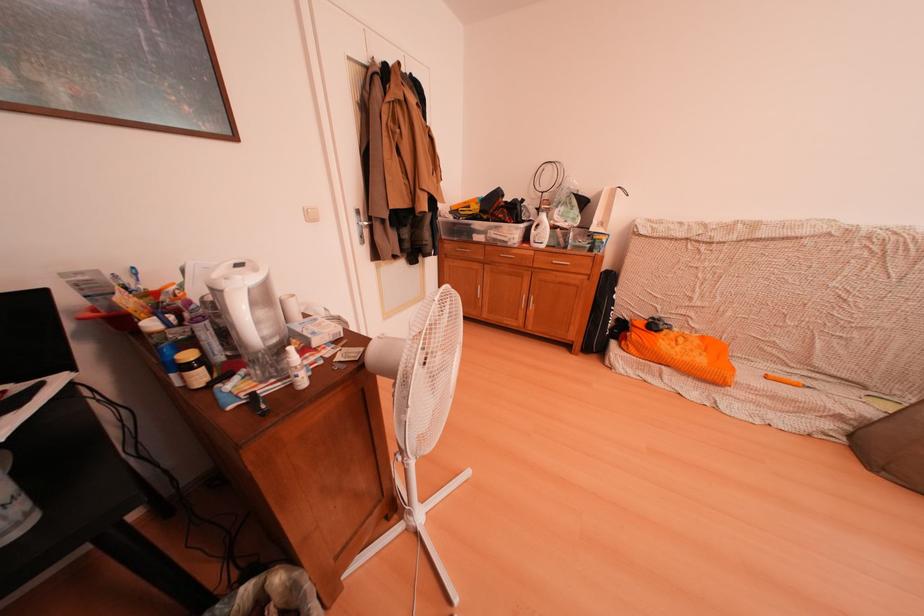
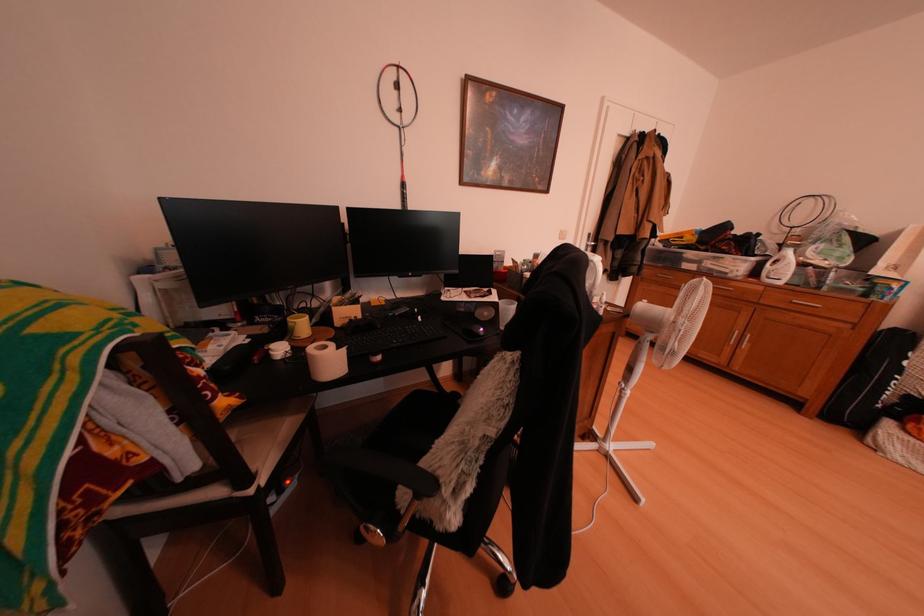
In the second image, find the point that corresponds to (536,227) in the first image.

(767, 261)